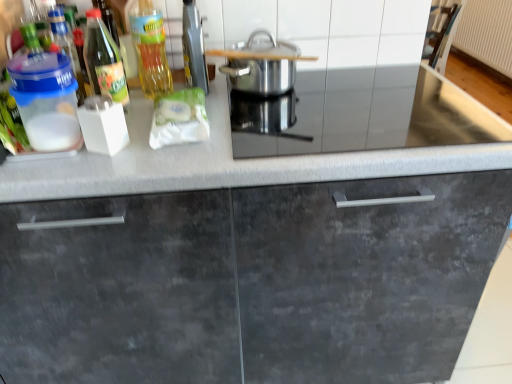
Where is `empty space that is ontop of matte gray cabinet at center`? The height and width of the screenshot is (384, 512). empty space that is ontop of matte gray cabinet at center is located at coordinates (276, 122).